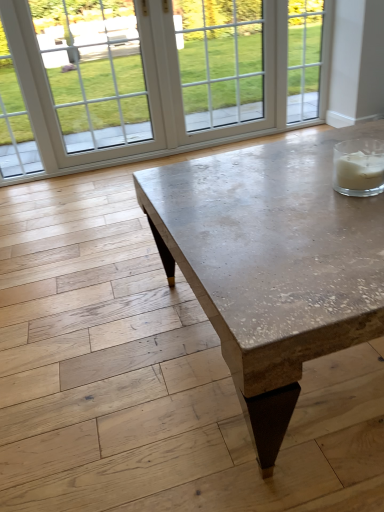
Question: Does point (21, 169) appear closer or farther from the camera than point (324, 203)?

Choices:
 (A) closer
 (B) farther

Answer: (B)

Question: From a real-world perspective, is white glass window at upper left physically located above or below matte concrete coffee table at center?

Choices:
 (A) above
 (B) below

Answer: (A)

Question: Considering the relative positions of white glass window at upper left and matte concrete coffee table at center in the image provided, is white glass window at upper left to the left or to the right of matte concrete coffee table at center?

Choices:
 (A) left
 (B) right

Answer: (A)

Question: Do you think matte concrete coffee table at center is within white glass window at upper left, or outside of it?

Choices:
 (A) outside
 (B) inside

Answer: (A)

Question: Is matte concrete coffee table at center taller or shorter than white glass window at upper left?

Choices:
 (A) tall
 (B) short

Answer: (B)

Question: Considering the positions of point (367, 335) and point (33, 135), is point (367, 335) closer or farther from the camera than point (33, 135)?

Choices:
 (A) farther
 (B) closer

Answer: (B)

Question: Considering their positions, is matte concrete coffee table at center located in front of or behind white glass window at upper left?

Choices:
 (A) front
 (B) behind

Answer: (A)